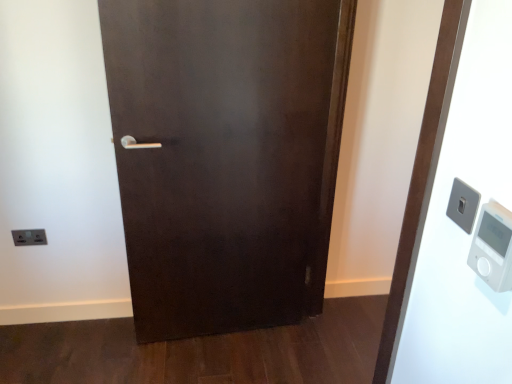
Question: Considering the relative sizes of satin silver switch at upper right, positioned as the 2th light switch in bottom-to-top order, and white plastic elevator at right in the image provided, is satin silver switch at upper right, positioned as the 2th light switch in bottom-to-top order, taller than white plastic elevator at right?

Choices:
 (A) yes
 (B) no

Answer: (B)

Question: From the image's perspective, is satin silver switch at upper right, the first light switch from the right, under white plastic elevator at right?

Choices:
 (A) yes
 (B) no

Answer: (B)

Question: Considering the relative sizes of satin silver switch at upper right, the second light switch viewed from the back, and white plastic elevator at right in the image provided, is satin silver switch at upper right, the second light switch viewed from the back, wider than white plastic elevator at right?

Choices:
 (A) yes
 (B) no

Answer: (B)

Question: Considering the relative positions of satin silver switch at upper right, acting as the 1th light switch starting from the front, and white plastic elevator at right in the image provided, is satin silver switch at upper right, acting as the 1th light switch starting from the front, behind white plastic elevator at right?

Choices:
 (A) yes
 (B) no

Answer: (A)

Question: Considering the relative sizes of satin silver switch at upper right, which is the 1th light switch from top to bottom, and white plastic elevator at right in the image provided, is satin silver switch at upper right, which is the 1th light switch from top to bottom, thinner than white plastic elevator at right?

Choices:
 (A) yes
 (B) no

Answer: (A)

Question: Can you see satin silver switch at upper right, the first light switch from the right, touching white plastic elevator at right?

Choices:
 (A) yes
 (B) no

Answer: (B)

Question: Does white plastic elevator at right come in front of satin silver switch at lower left, positioned as the first light switch in back-to-front order?

Choices:
 (A) yes
 (B) no

Answer: (A)

Question: From the image's perspective, is white plastic elevator at right below satin silver switch at lower left, marked as the 1th light switch in a left-to-right arrangement?

Choices:
 (A) no
 (B) yes

Answer: (A)

Question: Does white plastic elevator at right have a larger size compared to satin silver switch at lower left, the 2th light switch viewed from the front?

Choices:
 (A) no
 (B) yes

Answer: (B)

Question: Considering the relative sizes of white plastic elevator at right and satin silver switch at lower left, the 2th light switch viewed from the front, in the image provided, is white plastic elevator at right wider than satin silver switch at lower left, the 2th light switch viewed from the front,?

Choices:
 (A) yes
 (B) no

Answer: (A)

Question: Does white plastic elevator at right have a lesser width compared to satin silver switch at lower left, the 2th light switch viewed from the front?

Choices:
 (A) yes
 (B) no

Answer: (B)

Question: Does white plastic elevator at right have a greater height compared to satin silver switch at lower left, marked as the 1th light switch in a left-to-right arrangement?

Choices:
 (A) yes
 (B) no

Answer: (A)

Question: Does white plastic thermometer at right lie behind satin silver switch at upper right, acting as the 1th light switch starting from the front?

Choices:
 (A) yes
 (B) no

Answer: (B)